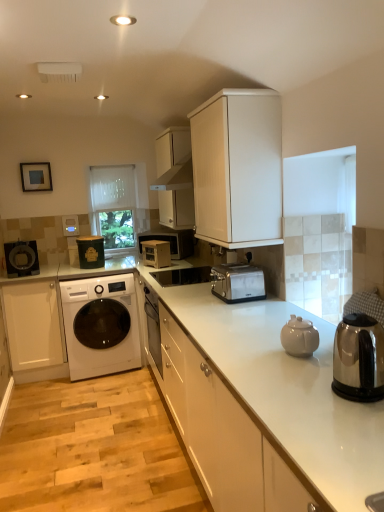
The width and height of the screenshot is (384, 512). Identify the location of matte black coffee maker at left, acting as the 1th appliance starting from the left. (21, 258).

Consider the image. Measure the distance between matte green container at center-left, the 2th appliance in the left-to-right sequence, and camera.

They are 3.61 meters apart.

The height and width of the screenshot is (512, 384). Describe the element at coordinates (175, 178) in the screenshot. I see `white matte cabinet at upper center, marked as the second cabinetry in a left-to-right arrangement` at that location.

In order to face white glossy washing machine at left, should I rotate leftwards or rightwards?

A 12.289 degree turn to the left will do.

Find the location of `wooden microwave at center`. wooden microwave at center is located at coordinates (171, 240).

Describe the element at coordinates (359, 358) in the screenshot. I see `stainless steel kettle at right` at that location.

Find the location of a particular element. The width and height of the screenshot is (384, 512). stainless steel kettle at right is located at coordinates (359, 358).

At what (x,y) coordinates should I click in order to perform the action: click on matte black coffee maker at left, acting as the 1th appliance starting from the left. Please return your answer as a coordinate pair (x, y). Looking at the image, I should click on (21, 258).

Locate an element on the screen. The width and height of the screenshot is (384, 512). washing machine on the right of white matte cabinet at lower left, marked as the first cabinetry in a left-to-right arrangement is located at coordinates (101, 325).

Between point (71, 320) and point (14, 333), which one is positioned in front?

The point (71, 320) is closer to the camera.

Is white glossy washing machine at left facing towards white matte cabinet at lower left, the 4th cabinetry viewed from the right?

No, white glossy washing machine at left is not facing towards white matte cabinet at lower left, the 4th cabinetry viewed from the right.

In the scene shown: From the image's perspective, who appears lower, white glossy washing machine at left or white matte cabinet at lower left, marked as the first cabinetry in a left-to-right arrangement?

white matte cabinet at lower left, marked as the first cabinetry in a left-to-right arrangement, from the image's perspective.

Is matte green container at center-left, the 2th appliance in the left-to-right sequence, thinner than wooden microwave at center, the first appliance in the right-to-left sequence?

Incorrect, the width of matte green container at center-left, the 2th appliance in the left-to-right sequence, is not less than that of wooden microwave at center, the first appliance in the right-to-left sequence.

From the image's perspective, which object appears higher, matte green container at center-left, the 2th appliance in the left-to-right sequence, or wooden microwave at center, the first appliance in the right-to-left sequence?

matte green container at center-left, the 2th appliance in the left-to-right sequence, from the image's perspective.

From the picture: Who is more distant, matte green container at center-left, the 2th appliance in the left-to-right sequence, or wooden microwave at center, the first appliance in the right-to-left sequence?

matte green container at center-left, the 2th appliance in the left-to-right sequence.

Between matte black coffee maker at left, which is counted as the 3th appliance, starting from the right, and white matte cabinet at upper center, marked as the second cabinetry in a left-to-right arrangement, which one appears on the right side from the viewer's perspective?

white matte cabinet at upper center, marked as the second cabinetry in a left-to-right arrangement, is more to the right.

Is matte black coffee maker at left, which is counted as the 3th appliance, starting from the right, placed right next to white matte cabinet at upper center, which appears as the third cabinetry when viewed from the right?

No, matte black coffee maker at left, which is counted as the 3th appliance, starting from the right, is not in contact with white matte cabinet at upper center, which appears as the third cabinetry when viewed from the right.

Is matte black coffee maker at left, which is counted as the 3th appliance, starting from the right, aimed at white matte cabinet at upper center, marked as the second cabinetry in a left-to-right arrangement?

No, matte black coffee maker at left, which is counted as the 3th appliance, starting from the right, does not turn towards white matte cabinet at upper center, marked as the second cabinetry in a left-to-right arrangement.

From a real-world perspective, is matte black coffee maker at left, acting as the 1th appliance starting from the left, physically below white matte cabinet at upper center, marked as the second cabinetry in a left-to-right arrangement?

Yes.

Is white glossy cabinet at center, positioned as the 4th cabinetry in left-to-right order, bigger or smaller than white textured cabinet at upper center, the 3th cabinetry from the left?

Considering their sizes, white glossy cabinet at center, positioned as the 4th cabinetry in left-to-right order, takes up more space than white textured cabinet at upper center, the 3th cabinetry from the left.

At what (x,y) coordinates should I click in order to perform the action: click on cabinetry that appears on the right of white textured cabinet at upper center, the 3th cabinetry from the left. Please return your answer as a coordinate pair (x, y). Image resolution: width=384 pixels, height=512 pixels. Looking at the image, I should click on (223, 434).

Does white glossy cabinet at center, placed as the 1th cabinetry when sorted from right to left, turn towards white textured cabinet at upper center, the 3th cabinetry from the left?

No, white glossy cabinet at center, placed as the 1th cabinetry when sorted from right to left, is not facing towards white textured cabinet at upper center, the 3th cabinetry from the left.

From a real-world perspective, is white glossy cabinet at center, placed as the 1th cabinetry when sorted from right to left, physically located above or below white textured cabinet at upper center, arranged as the 2th cabinetry when viewed from the right?

In terms of real-world spatial position, white glossy cabinet at center, placed as the 1th cabinetry when sorted from right to left, is below white textured cabinet at upper center, arranged as the 2th cabinetry when viewed from the right.

Locate an element on the screen. Image resolution: width=384 pixels, height=512 pixels. washing machine in front of the white fabric window screen at center is located at coordinates (101, 325).

Between white fabric window screen at center and white glossy washing machine at left, which one appears on the right side from the viewer's perspective?

From the viewer's perspective, white fabric window screen at center appears more on the right side.

Which object is further away from the camera taking this photo, white fabric window screen at center or white glossy washing machine at left?

white fabric window screen at center is further from the camera.

Is white fabric window screen at center inside or outside of white glossy washing machine at left?

white fabric window screen at center is not enclosed by white glossy washing machine at left.

Which object is thinner, white matte cabinet at upper center, marked as the second cabinetry in a left-to-right arrangement, or satin silver sink at center?

Thinner between the two is white matte cabinet at upper center, marked as the second cabinetry in a left-to-right arrangement.

Considering the relative sizes of white matte cabinet at upper center, marked as the second cabinetry in a left-to-right arrangement, and satin silver sink at center in the image provided, is white matte cabinet at upper center, marked as the second cabinetry in a left-to-right arrangement, taller than satin silver sink at center?

Yes, white matte cabinet at upper center, marked as the second cabinetry in a left-to-right arrangement, is taller than satin silver sink at center.

From a real-world perspective, is white matte cabinet at upper center, which appears as the third cabinetry when viewed from the right, beneath satin silver sink at center?

No, from a real-world perspective, white matte cabinet at upper center, which appears as the third cabinetry when viewed from the right, is not beneath satin silver sink at center.

Which point is more forward, (167, 198) or (175, 272)?

Point (175, 272)

Does point (21, 297) lie behind point (78, 248)?

No.

Considering the relative sizes of white matte cabinet at lower left, the 4th cabinetry viewed from the right, and matte green container at center-left, the 2th appliance in the left-to-right sequence, in the image provided, is white matte cabinet at lower left, the 4th cabinetry viewed from the right, taller than matte green container at center-left, the 2th appliance in the left-to-right sequence,?

Correct, white matte cabinet at lower left, the 4th cabinetry viewed from the right, is much taller as matte green container at center-left, the 2th appliance in the left-to-right sequence.

Is white matte cabinet at lower left, the 4th cabinetry viewed from the right, oriented away from matte green container at center-left, the second appliance in the right-to-left sequence?

white matte cabinet at lower left, the 4th cabinetry viewed from the right, does not have its back to matte green container at center-left, the second appliance in the right-to-left sequence.

Would you consider white matte cabinet at lower left, marked as the first cabinetry in a left-to-right arrangement, to be distant from matte green container at center-left, the 2th appliance in the left-to-right sequence?

That's not correct — white matte cabinet at lower left, marked as the first cabinetry in a left-to-right arrangement, is a little close to matte green container at center-left, the 2th appliance in the left-to-right sequence.

Locate an element on the screen. Image resolution: width=384 pixels, height=512 pixels. washing machine on the right of white matte cabinet at lower left, the 4th cabinetry viewed from the right is located at coordinates (101, 325).

The image size is (384, 512). I want to click on appliance above the wooden microwave at center, the 3th appliance in the left-to-right sequence (from the image's perspective), so click(x=91, y=251).

Considering their positions, is white glossy washing machine at left positioned closer to wooden microwave at center, the 3th appliance in the left-to-right sequence, than white textured cabinet at upper center, arranged as the 2th cabinetry when viewed from the right?

white glossy washing machine at left is closer to wooden microwave at center, the 3th appliance in the left-to-right sequence.

When comparing their distances from white matte cabinet at lower left, the 4th cabinetry viewed from the right, does stainless steel kettle at right or white fabric window screen at center seem further?

Based on the image, stainless steel kettle at right appears to be further to white matte cabinet at lower left, the 4th cabinetry viewed from the right.

Which object lies further to the anchor point matte green container at center-left, the 2th appliance in the left-to-right sequence, white glossy washing machine at left or white glossy cabinet at center, positioned as the 4th cabinetry in left-to-right order?

Among the two, white glossy cabinet at center, positioned as the 4th cabinetry in left-to-right order, is located further to matte green container at center-left, the 2th appliance in the left-to-right sequence.

When comparing their distances from white textured cabinet at upper center, the 3th cabinetry from the left, does stainless steel kettle at right or satin silver sink at center seem closer?

The object closer to white textured cabinet at upper center, the 3th cabinetry from the left, is satin silver sink at center.

When comparing their distances from matte black coffee maker at left, which is counted as the 3th appliance, starting from the right, does satin silver toaster at center or stainless steel kettle at right seem further?

stainless steel kettle at right lies further to matte black coffee maker at left, which is counted as the 3th appliance, starting from the right, than the other object.

Looking at the image, which one is located further to matte green container at center-left, the second appliance in the right-to-left sequence, white matte cabinet at lower left, marked as the first cabinetry in a left-to-right arrangement, or wooden microwave at center?

white matte cabinet at lower left, marked as the first cabinetry in a left-to-right arrangement, is positioned further to the anchor matte green container at center-left, the second appliance in the right-to-left sequence.

Considering their positions, is white matte cabinet at upper center, marked as the second cabinetry in a left-to-right arrangement, positioned further to satin silver sink at center than wooden microwave at center?

white matte cabinet at upper center, marked as the second cabinetry in a left-to-right arrangement, lies further to satin silver sink at center than the other object.

Looking at the image, which one is located closer to stainless steel kettle at right, white textured cabinet at upper center, arranged as the 2th cabinetry when viewed from the right, or matte green container at center-left, the 2th appliance in the left-to-right sequence?

Based on the image, white textured cabinet at upper center, arranged as the 2th cabinetry when viewed from the right, appears to be nearer to stainless steel kettle at right.

The height and width of the screenshot is (512, 384). In order to click on washing machine between white matte cabinet at lower left, marked as the first cabinetry in a left-to-right arrangement, and white textured cabinet at upper center, the 3th cabinetry from the left in this screenshot , I will do `click(101, 325)`.

This screenshot has height=512, width=384. I want to click on sink between satin silver toaster at center and wooden microwave at center along the z-axis, so click(182, 276).

Identify the location of washing machine located between white glossy cabinet at center, positioned as the 4th cabinetry in left-to-right order, and white fabric window screen at center in the depth direction. (101, 325).

You are a GUI agent. You are given a task and a screenshot of the screen. Output one action in this format:
    pyautogui.click(x=<x>, y=<y>)
    Task: Click on the window screen situated between matte black coffee maker at left, which is counted as the 3th appliance, starting from the right, and wooden microwave at center, the first appliance in the right-to-left sequence, from left to right
    The width and height of the screenshot is (384, 512).
    Given the screenshot: What is the action you would take?
    pyautogui.click(x=113, y=205)